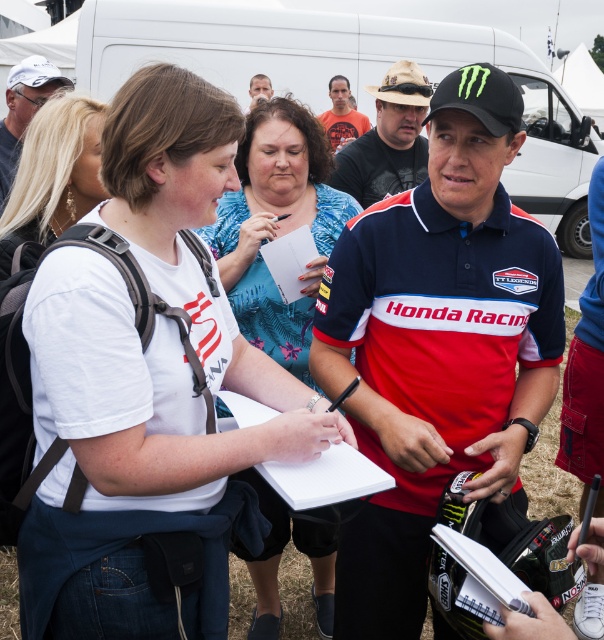
You are planning to take a photo of the public figure signing autographs. The white van at center might block your view. Based on its position, can you estimate if the van is directly behind the public figure or off to the side?

The white van at center is located at point [349,76], which places it directly behind the public figure, potentially blocking the view.